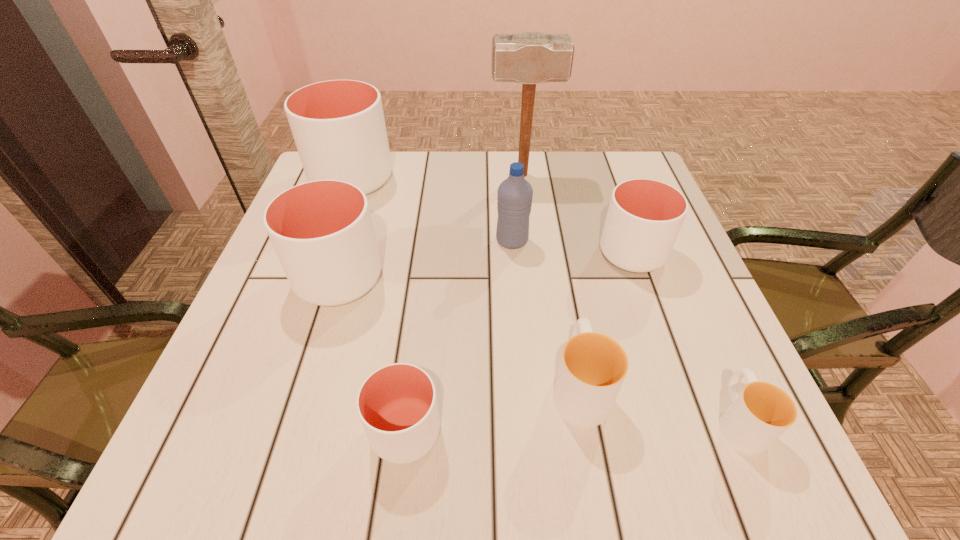
Where is `object that is at the near right corner`? The height and width of the screenshot is (540, 960). object that is at the near right corner is located at coordinates (762, 412).

In the image, there is a desktop. Where is `free region at the far edge`? free region at the far edge is located at coordinates (463, 162).

Identify the location of free spot at the near edge of the desktop. (454, 461).

At what (x,y) coordinates should I click in order to perform the action: click on blank space at the left edge of the desktop. Please return your answer as a coordinate pair (x, y). The width and height of the screenshot is (960, 540). Looking at the image, I should click on (215, 410).

At what (x,y) coordinates should I click in order to perform the action: click on free region at the right edge of the desktop. Please return your answer as a coordinate pair (x, y). This screenshot has width=960, height=540. Looking at the image, I should click on (663, 352).

This screenshot has width=960, height=540. What are the coordinates of `vacant area at the far right corner` in the screenshot? It's located at pos(588,154).

Identify the location of blank region between the second biggest white cup and the fourth shortest object. The height and width of the screenshot is (540, 960). (486, 266).

You are a GUI agent. You are given a task and a screenshot of the screen. Output one action in this format:
    pyautogui.click(x=<x>, y=<y>)
    Task: Click on the vacant area between the blue water bottle and the third white cup from left to right
    This screenshot has width=960, height=540.
    Given the screenshot: What is the action you would take?
    pyautogui.click(x=459, y=336)

In order to click on free area in between the tallest object and the fourth cup from right to left in this screenshot , I will do `click(464, 303)`.

Locate an element on the screen. The width and height of the screenshot is (960, 540). vacant point located between the third object from left to right and the mallet is located at coordinates (464, 303).